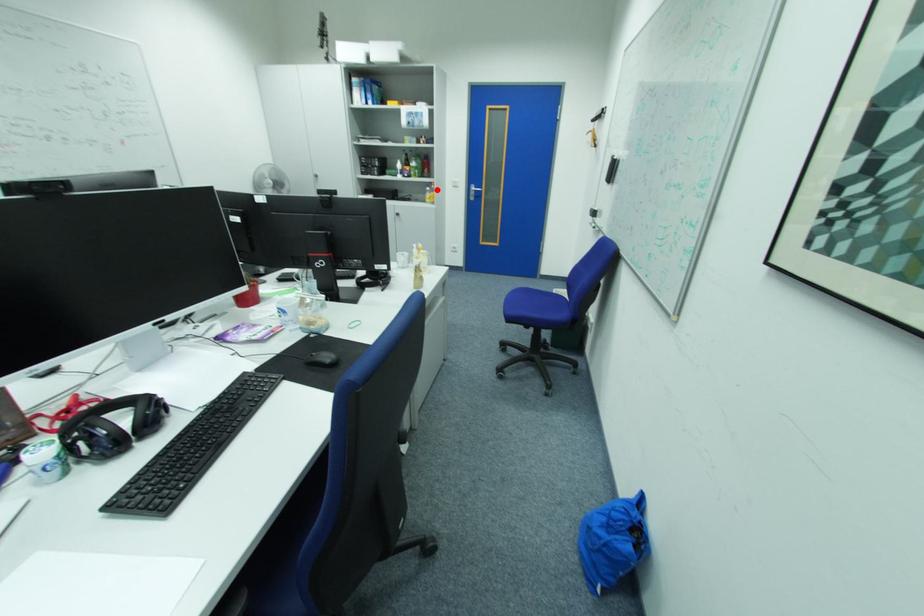
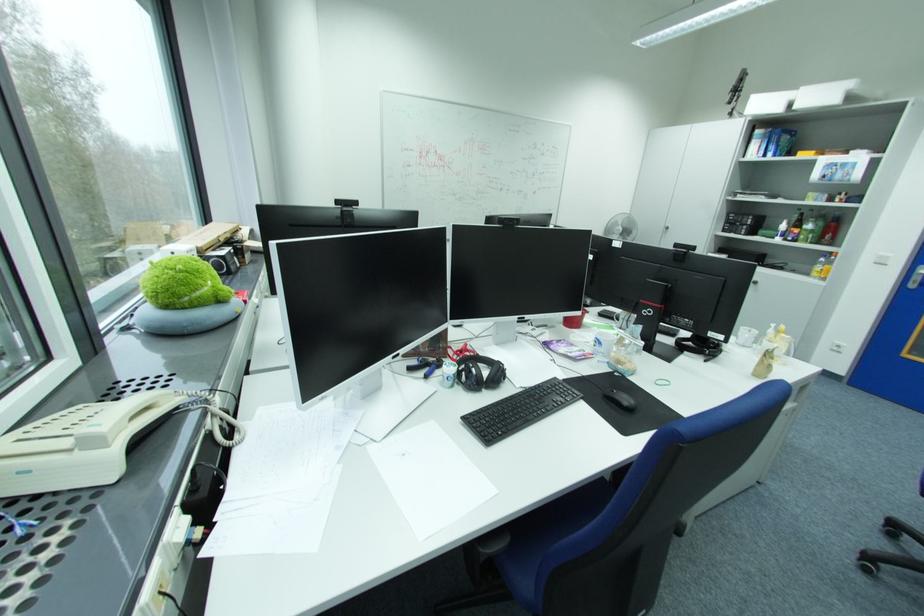
Question: A red point is marked in image1. In image2, is the corresponding 3D point closer to the camera or farther? Reply with the corresponding letter.

Choices:
 (A) The corresponding 3D point is closer.
 (B) The corresponding 3D point is farther.

Answer: (B)